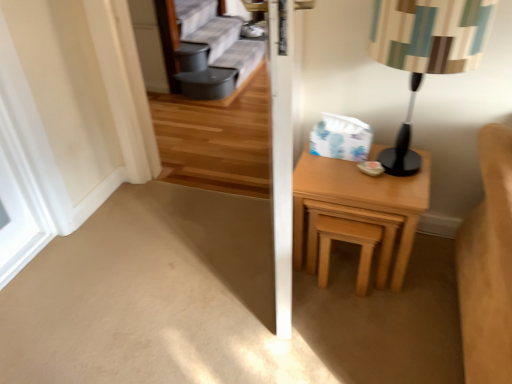
The height and width of the screenshot is (384, 512). In order to click on free space in front of light wood/texture nightstand at right in this screenshot , I will do `click(370, 327)`.